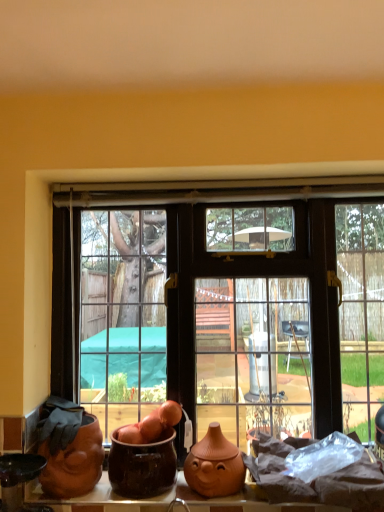
Question: From the image's perspective, is matte terracotta pot at lower left, which appears as the 1th pottery when viewed from the left, under matte orange clay vase at center, which appears as the 1th pottery when viewed from the right?

Choices:
 (A) no
 (B) yes

Answer: (A)

Question: Would you say matte terracotta pot at lower left, arranged as the third pottery when viewed from the right, contains matte orange clay vase at center, the third pottery when ordered from left to right?

Choices:
 (A) no
 (B) yes

Answer: (A)

Question: Does matte terracotta pot at lower left, arranged as the third pottery when viewed from the right, appear on the left side of matte orange clay vase at center, the third pottery when ordered from left to right?

Choices:
 (A) yes
 (B) no

Answer: (A)

Question: Does matte terracotta pot at lower left, which appears as the 1th pottery when viewed from the left, lie behind matte orange clay vase at center, which appears as the 1th pottery when viewed from the right?

Choices:
 (A) no
 (B) yes

Answer: (A)

Question: Can you confirm if matte terracotta pot at lower left, which appears as the 1th pottery when viewed from the left, is wider than matte orange clay vase at center, the third pottery when ordered from left to right?

Choices:
 (A) yes
 (B) no

Answer: (A)

Question: From the image's perspective, does matte terracotta pot at lower left, arranged as the third pottery when viewed from the right, appear higher than matte orange clay vase at center, which appears as the 1th pottery when viewed from the right?

Choices:
 (A) no
 (B) yes

Answer: (B)

Question: Is matte terracotta pot at lower left, which appears as the 1th pottery when viewed from the left, at the left side of matte glass window at center?

Choices:
 (A) yes
 (B) no

Answer: (A)

Question: Is matte terracotta pot at lower left, which appears as the 1th pottery when viewed from the left, positioned far away from matte glass window at center?

Choices:
 (A) no
 (B) yes

Answer: (B)

Question: Is matte terracotta pot at lower left, which appears as the 1th pottery when viewed from the left, outside matte glass window at center?

Choices:
 (A) yes
 (B) no

Answer: (A)

Question: Is matte terracotta pot at lower left, arranged as the third pottery when viewed from the right, positioned with its back to matte glass window at center?

Choices:
 (A) yes
 (B) no

Answer: (A)

Question: Can you confirm if matte terracotta pot at lower left, which appears as the 1th pottery when viewed from the left, is taller than matte glass window at center?

Choices:
 (A) no
 (B) yes

Answer: (A)

Question: From a real-world perspective, is matte terracotta pot at lower left, arranged as the third pottery when viewed from the right, on top of matte glass window at center?

Choices:
 (A) yes
 (B) no

Answer: (B)

Question: Does matte glass window at center have a larger size compared to brown glazed pot at center, positioned as the 2th pottery in left-to-right order?

Choices:
 (A) no
 (B) yes

Answer: (B)